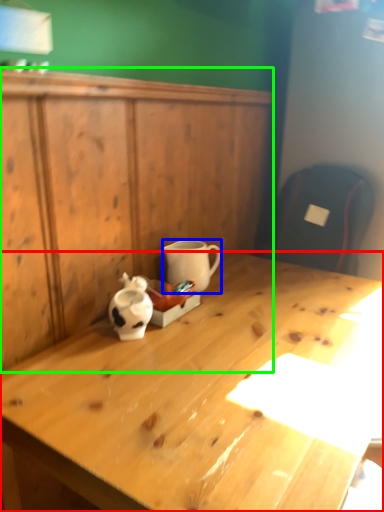
Question: Estimate the real-world distances between objects in this image. Which object is farther from desk (highlighted by a red box), coffee cup (highlighted by a blue box) or dresser (highlighted by a green box)?

Choices:
 (A) coffee cup
 (B) dresser

Answer: (B)